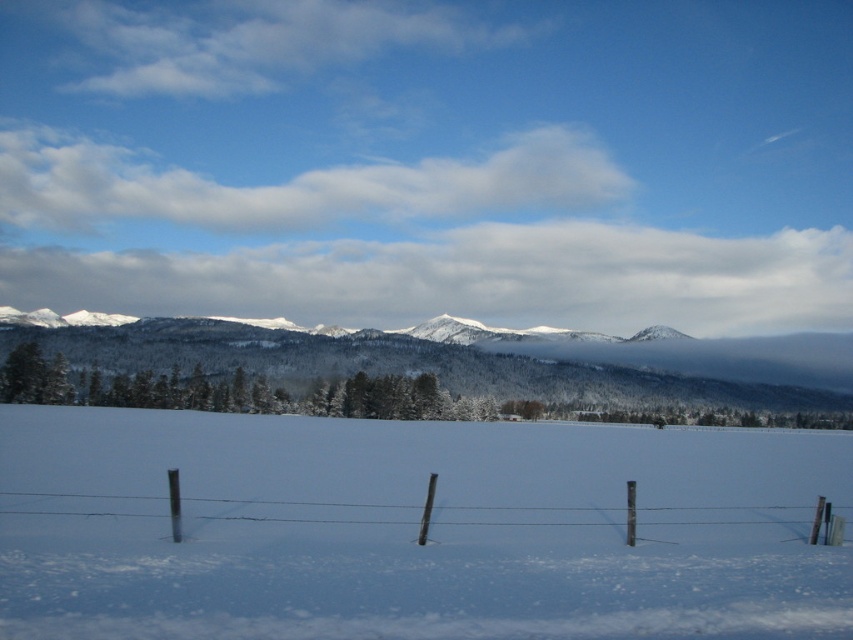
Consider the image. Which is above, white powdery snow at center or snow-covered mountain at center?

snow-covered mountain at center is higher up.

Can you confirm if white powdery snow at center is thinner than snow-covered mountain at center?

Yes, white powdery snow at center is thinner than snow-covered mountain at center.

Who is more forward, (x=36, y=545) or (x=582, y=401)?

Point (x=36, y=545) is more forward.

This screenshot has width=853, height=640. In order to click on white powdery snow at center in this screenshot , I will do `click(412, 529)`.

Does snow-covered mountain at center have a greater height compared to wooden post wire fence at lower center?

Correct, snow-covered mountain at center is much taller as wooden post wire fence at lower center.

Who is more distant from viewer, (x=299, y=344) or (x=476, y=508)?

The point (x=299, y=344) is more distant.

This screenshot has width=853, height=640. In order to click on snow-covered mountain at center in this screenshot , I will do `click(387, 369)`.

This screenshot has height=640, width=853. What do you see at coordinates (412, 529) in the screenshot?
I see `white powdery snow at center` at bounding box center [412, 529].

Does white powdery snow at center appear on the right side of wooden post wire fence at lower center?

Yes, white powdery snow at center is to the right of wooden post wire fence at lower center.

What do you see at coordinates (412, 529) in the screenshot? The width and height of the screenshot is (853, 640). I see `white powdery snow at center` at bounding box center [412, 529].

The width and height of the screenshot is (853, 640). What are the coordinates of `white powdery snow at center` in the screenshot? It's located at (412, 529).